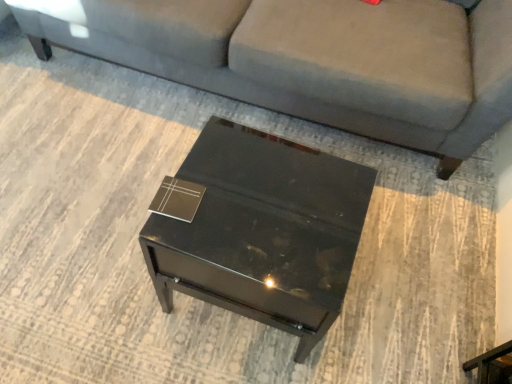
Identify the location of gray fabric couch at center. (313, 59).

Locate an element on the screen. gray fabric couch at center is located at coordinates pyautogui.click(x=313, y=59).

Measure the distance between gray fabric couch at center and matte black book at center.

They are 32.41 inches apart.

Considering the positions of point (260, 98) and point (178, 186), is point (260, 98) closer or farther from the camera than point (178, 186)?

Point (260, 98).

Image resolution: width=512 pixels, height=384 pixels. Find the location of `studio couch that appears on the right of matte black book at center`. studio couch that appears on the right of matte black book at center is located at coordinates (313, 59).

Who is bigger, gray fabric couch at center or matte black book at center?

Bigger between the two is gray fabric couch at center.

Which object is thinner, gray fabric couch at center or glossy black side table at center?

glossy black side table at center is thinner.

Could you tell me if gray fabric couch at center is turned towards glossy black side table at center?

Yes, gray fabric couch at center is facing glossy black side table at center.

Can you confirm if gray fabric couch at center is bigger than glossy black side table at center?

Yes.

From a real-world perspective, is gray fabric couch at center physically located above or below glossy black side table at center?

gray fabric couch at center is situated higher than glossy black side table at center in the real world.

Based on the photo, how different are the orientations of glossy black side table at center and gray fabric couch at center in degrees?

The facing directions of glossy black side table at center and gray fabric couch at center are 90.3 degrees apart.

Which of these two, glossy black side table at center or gray fabric couch at center, is bigger?

gray fabric couch at center is bigger.

Locate an element on the screen. table in front of the gray fabric couch at center is located at coordinates (263, 231).

Is gray fabric couch at center a part of glossy black side table at center?

No, glossy black side table at center does not contain gray fabric couch at center.

Find the location of a particular element. square on the left of glossy black side table at center is located at coordinates (177, 199).

From a real-world perspective, is matte black book at center positioned above or below glossy black side table at center?

matte black book at center is situated higher than glossy black side table at center in the real world.

Could you tell me if matte black book at center is turned towards glossy black side table at center?

No, matte black book at center does not turn towards glossy black side table at center.

Who is smaller, matte black book at center or glossy black side table at center?

matte black book at center.

How different are the orientations of matte black book at center and gray fabric couch at center in degrees?

The facing directions of matte black book at center and gray fabric couch at center are 80.3 degrees apart.

Does matte black book at center have a larger size compared to gray fabric couch at center?

Incorrect, matte black book at center is not larger than gray fabric couch at center.

Locate an element on the screen. studio couch behind the matte black book at center is located at coordinates tap(313, 59).

In the scene shown: Considering the positions of objects glossy black side table at center and matte black book at center in the image provided, who is in front, glossy black side table at center or matte black book at center?

glossy black side table at center is in front.

Is point (309, 353) more distant than point (190, 197)?

Yes.

Is glossy black side table at center looking in the opposite direction of matte black book at center?

No, glossy black side table at center is not facing the opposite direction of matte black book at center.

Which of these two, glossy black side table at center or matte black book at center, is smaller?

matte black book at center.

At what (x,y) coordinates should I click in order to perform the action: click on studio couch located on the right of matte black book at center. Please return your answer as a coordinate pair (x, y). The width and height of the screenshot is (512, 384). Looking at the image, I should click on (313, 59).

Find the location of a particular element. The height and width of the screenshot is (384, 512). table in front of the gray fabric couch at center is located at coordinates (263, 231).

Consider the image. Considering their positions, is matte black book at center positioned closer to gray fabric couch at center than glossy black side table at center?

glossy black side table at center.

From the image, which object appears to be farther from glossy black side table at center, gray fabric couch at center or matte black book at center?

Among the two, gray fabric couch at center is located further to glossy black side table at center.

Consider the image. Looking at the image, which one is located closer to matte black book at center, gray fabric couch at center or glossy black side table at center?

Among the two, glossy black side table at center is located nearer to matte black book at center.

Which object lies further to the anchor point glossy black side table at center, matte black book at center or gray fabric couch at center?

Among the two, gray fabric couch at center is located further to glossy black side table at center.

In the scene shown: When comparing their distances from matte black book at center, does glossy black side table at center or gray fabric couch at center seem closer?

glossy black side table at center is positioned closer to the anchor matte black book at center.

Which object lies further to the anchor point gray fabric couch at center, glossy black side table at center or matte black book at center?

matte black book at center.

I want to click on square between gray fabric couch at center and glossy black side table at center in the vertical direction, so click(x=177, y=199).